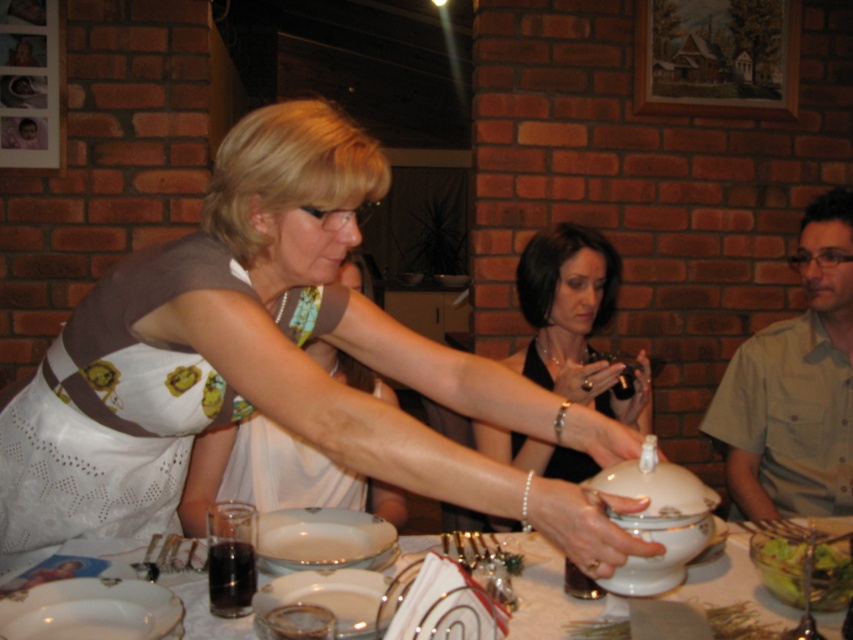
Who is more distant from viewer, (531, 273) or (352, 572)?

The point (531, 273) is more distant.

Is matte black camera at center positioned before gold metallic platter at center?

No, matte black camera at center is behind gold metallic platter at center.

Does point (546, 371) lie in front of point (354, 582)?

No, it is behind (354, 582).

Where is `matte black camera at center`? The image size is (853, 640). matte black camera at center is located at coordinates (573, 320).

Does matte black camera at center appear on the right side of white glossy lid at center?

Yes, matte black camera at center is to the right of white glossy lid at center.

Is the position of matte black camera at center less distant than that of white glossy lid at center?

No, matte black camera at center is further to the viewer.

At what (x,y) coordinates should I click in order to perform the action: click on matte black camera at center. Please return your answer as a coordinate pair (x, y). This screenshot has height=640, width=853. Looking at the image, I should click on (573, 320).

You are a GUI agent. You are given a task and a screenshot of the screen. Output one action in this format:
    pyautogui.click(x=<x>, y=<y>)
    Task: Click on the matte black camera at center
    
    Given the screenshot: What is the action you would take?
    pyautogui.click(x=573, y=320)

Which of these two, light beige shirt at right or matte black camera at center, stands taller?

matte black camera at center is taller.

Is light beige shirt at right wider than matte black camera at center?

No, light beige shirt at right is not wider than matte black camera at center.

Which is behind, point (805, 221) or point (538, 458)?

Positioned behind is point (805, 221).

Locate an element on the screen. The image size is (853, 640). light beige shirt at right is located at coordinates (796, 385).